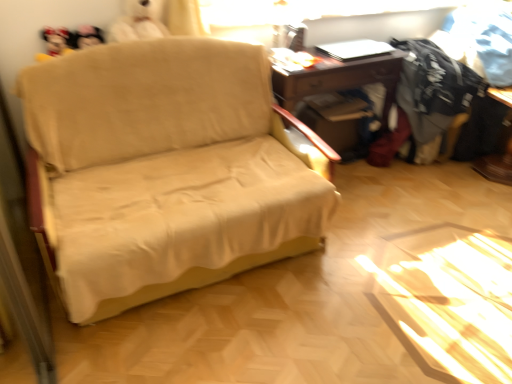
Where is `vacant point to the right of wooden desk at center`? vacant point to the right of wooden desk at center is located at coordinates 417,183.